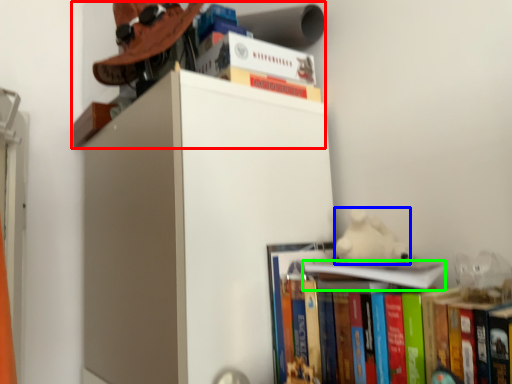
Question: Which object is the closest to the shelf (highlighted by a red box)? Choose among these: animal (highlighted by a blue box) or book (highlighted by a green box).

Choices:
 (A) animal
 (B) book

Answer: (A)